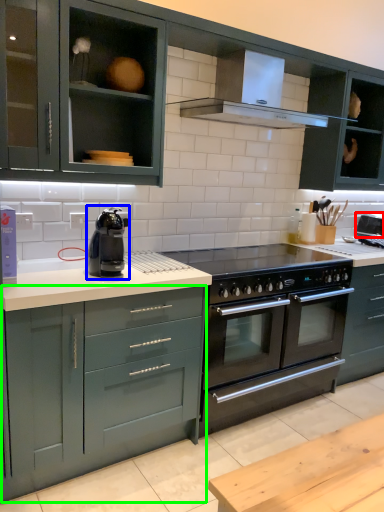
Question: Which object is the farthest from appliance (highlighted by a red box)? Choose among these: home appliance (highlighted by a blue box) or cabinetry (highlighted by a green box).

Choices:
 (A) home appliance
 (B) cabinetry

Answer: (B)